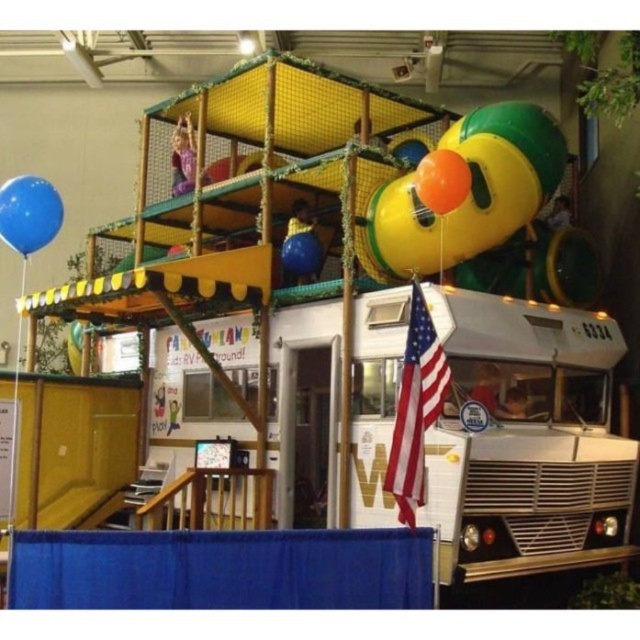
You are a child at the fair and want to grab both the rubber duck balloon at upper right and the orange rubber balloon at upper center. Which balloon is wider?

The rubber duck balloon at upper right is wider than the orange rubber balloon at upper center.

You are standing in front of the white RV with a clown face and want to take a photo of the play structure. You notice two points marked on the ground at coordinates point (380,515) and point (419,387). Which point should you stand at to ensure the play structure is fully visible without any obstruction from the RV?

You should stand at point (380,515) because it is closer to the camera and farther from the RV, allowing the play structure to be fully visible without obstruction.